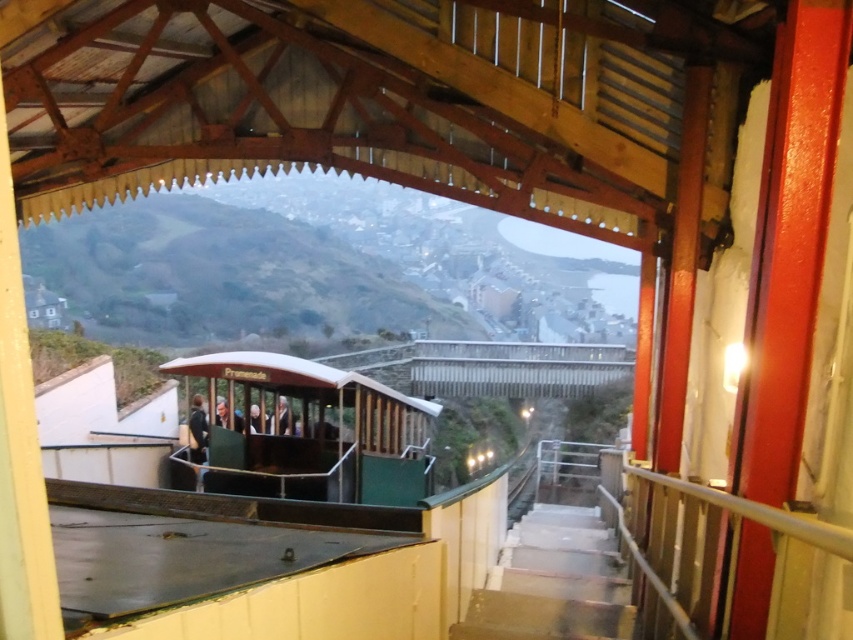
You are standing on the platform and want to board the green matte train car at center. The train doors are 1.5 meters wide. If you carry a 1.2 meter long backpack, will it fit through the door when you board?

The green matte train car at center is 8.66 meters away from the viewer. However, the question about the backpack fitting through the door depends on the backpack dimensions relative to the door width. The backpack is 1.2 meters long, which is shorter than the 1.5 meter wide door, so it should fit through the door when boarding.

You are a passenger waiting at the station. You see the green matte train car at center and the white concrete stairs at lower right. Which object is closer to you?

The white concrete stairs at lower right are closer to you because they are at the lower right of the image, which typically corresponds to the foreground in such scenes, whereas the green matte train car at center is positioned centrally, likely further back.

You are standing on the platform and want to board the train. You see the green matte train car at center and the dark brown leather jacket at center. Which object is closer to you?

The green matte train car at center is closer to the viewer than the dark brown leather jacket at center.